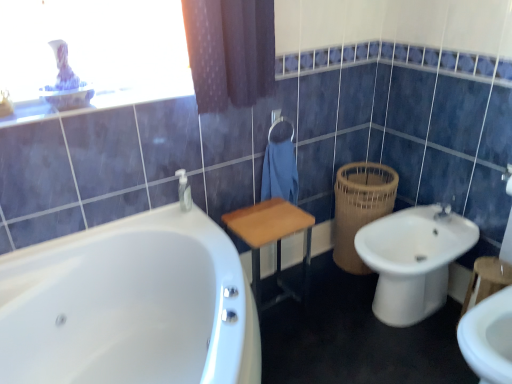
You are a GUI agent. You are given a task and a screenshot of the screen. Output one action in this format:
    pyautogui.click(x=<x>, y=<y>)
    Task: Click on the free space to the right of wooden table at center
    The image size is (512, 384).
    Given the screenshot: What is the action you would take?
    pyautogui.click(x=325, y=305)